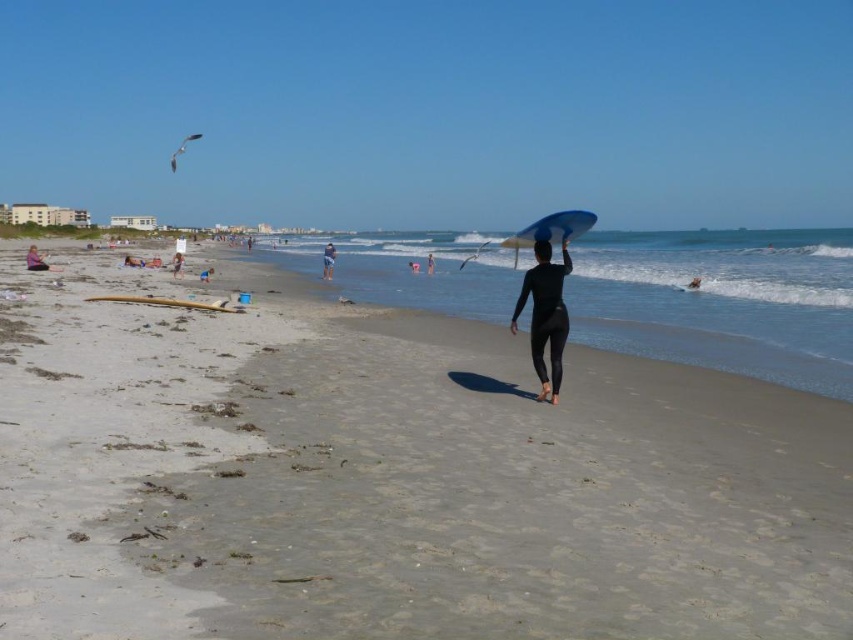
Looking at this image, you are a drone operator trying to capture a photo of the blue fabric surfboard at center. The drone is currently at coordinates point (328,260). Is the drone positioned directly above the blue fabric surfboard at center?

Yes, the point (328,260) corresponds to the blue fabric surfboard at center, so the drone is positioned directly above the blue fabric surfboard at center.

You are a photographer trying to capture the person with the surfboard and the wetsuit. Since both are matte black, how can you distinguish the matte black surfboard at left from the matte black wetsuit at center in your photo?

The matte black surfboard at left is above the matte black wetsuit at center, so you can distinguish them by their vertical positions in the photo.

You are a photographer trying to capture a shot of the matte black surfboard at left and the matte black wetsuit at center. From your current position, which object is positioned farther to the left?

The matte black surfboard at left is positioned farther to the left than the matte black wetsuit at center.